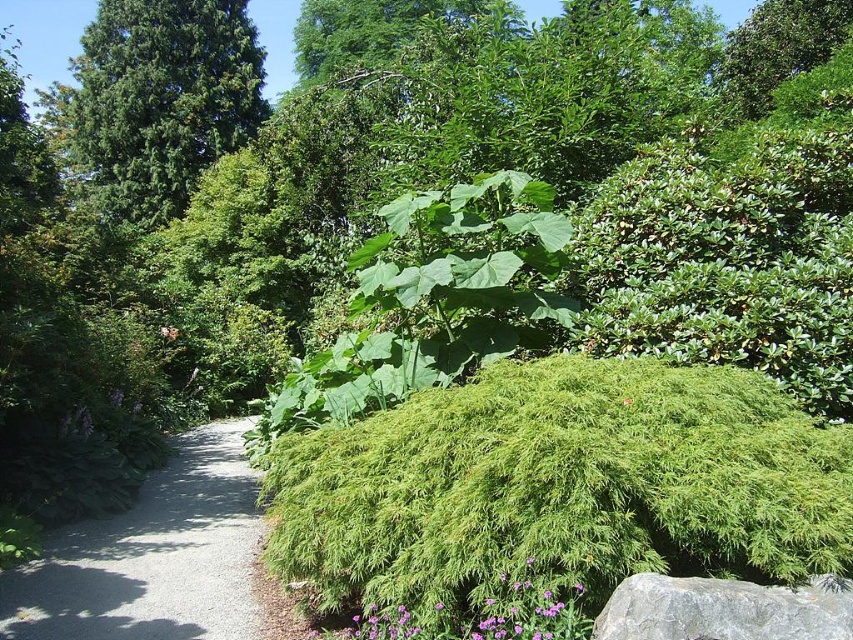
Question: Which of these objects is positioned closest to the gray gravel path at lower left?

Choices:
 (A) green leafy bush at center
 (B) green needle-like at upper left

Answer: (A)

Question: Which of these objects is positioned farthest from the green needle-like at upper left?

Choices:
 (A) gray rough rock at lower right
 (B) gray gravel path at lower left

Answer: (A)

Question: Does gray gravel path at lower left appear under gray rough rock at lower right?

Choices:
 (A) yes
 (B) no

Answer: (A)

Question: Observing the image, what is the correct spatial positioning of green leafy bush at center in reference to gray gravel path at lower left?

Choices:
 (A) right
 (B) left

Answer: (A)

Question: Which object is farther from the camera taking this photo?

Choices:
 (A) green leafy bush at center
 (B) green needle-like at upper left
 (C) gray rough rock at lower right
 (D) gray gravel path at lower left

Answer: (B)

Question: Is green needle-like at upper left below gray rough rock at lower right?

Choices:
 (A) no
 (B) yes

Answer: (A)